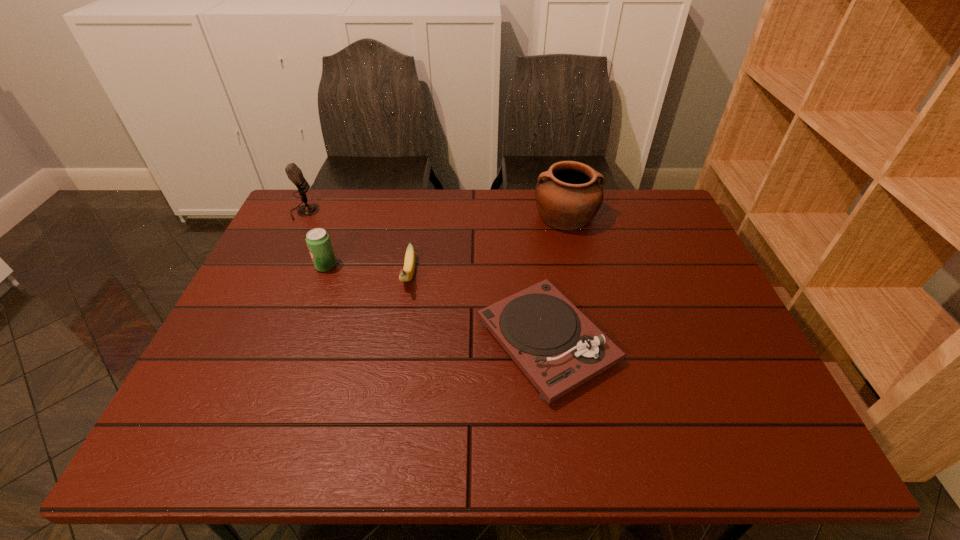
The width and height of the screenshot is (960, 540). What are the coordinates of `microphone` in the screenshot? It's located at (294, 173).

Locate an element on the screen. This screenshot has height=540, width=960. pottery is located at coordinates (568, 196).

Image resolution: width=960 pixels, height=540 pixels. In order to click on soda in this screenshot , I will do `click(318, 241)`.

Identify the location of the third tallest object. This screenshot has width=960, height=540. (318, 241).

Find the location of `the third object from left to right`. the third object from left to right is located at coordinates (405, 274).

At what (x,y) coordinates should I click in order to perform the action: click on the fourth tallest object. Please return your answer as a coordinate pair (x, y). Looking at the image, I should click on (405, 274).

Find the location of a particular element. Image resolution: width=960 pixels, height=540 pixels. the shortest object is located at coordinates (554, 344).

Identify the location of vacant space located 0.280m on the front-facing side of the leftmost object. (403, 212).

Where is `free space located 0.270m on the front of the pottery`? The width and height of the screenshot is (960, 540). free space located 0.270m on the front of the pottery is located at coordinates click(x=585, y=301).

You are a GUI agent. You are given a task and a screenshot of the screen. Output one action in this format:
    pyautogui.click(x=<x>, y=<y>)
    Task: Click on the vacant space located 0.300m on the back of the second object from left to right
    Image resolution: width=960 pixels, height=540 pixels.
    Given the screenshot: What is the action you would take?
    pyautogui.click(x=350, y=200)